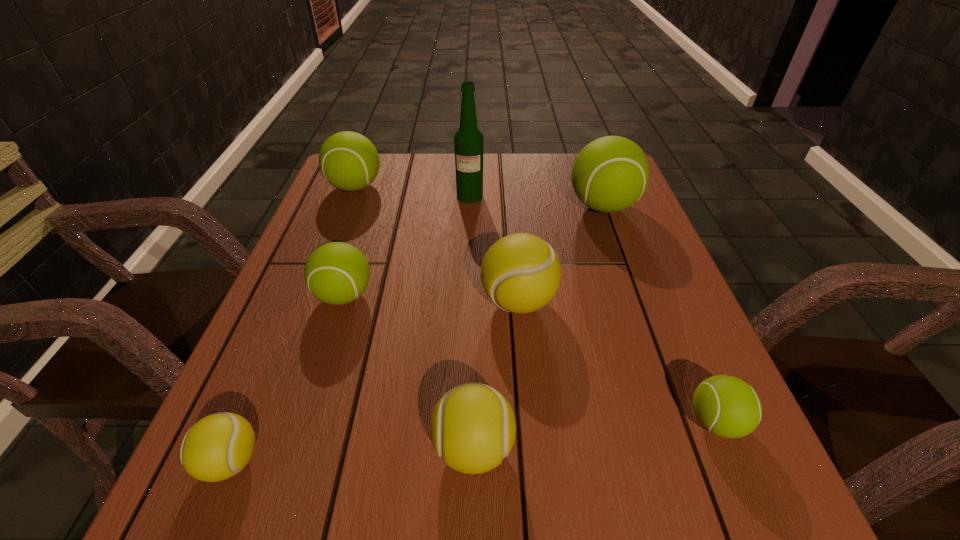
At what (x,y) coordinates should I click in order to perform the action: click on empty space that is in between the biggest green tennis ball and the nearest green tennis ball. Please return your answer as a coordinate pair (x, y). The height and width of the screenshot is (540, 960). Looking at the image, I should click on (660, 314).

The height and width of the screenshot is (540, 960). Identify the location of empty location between the second tallest object and the farthest yellow tennis ball. (561, 254).

Where is `free space between the second smallest yellow tennis ball and the green beer bottle`? free space between the second smallest yellow tennis ball and the green beer bottle is located at coordinates (471, 322).

Find the location of a particular element. This screenshot has width=960, height=540. vacant space in between the second smallest green tennis ball and the farthest yellow tennis ball is located at coordinates click(431, 299).

Find the location of `object that stands as the sixth closest to the second smallest yellow tennis ball`. object that stands as the sixth closest to the second smallest yellow tennis ball is located at coordinates (468, 140).

Locate an element on the screen. object that ranks as the second closest to the farthest yellow tennis ball is located at coordinates [x=610, y=174].

At what (x,y) coordinates should I click in order to perform the action: click on tennis ball that is the third nearest to the beer bottle. Please return your answer as a coordinate pair (x, y). Looking at the image, I should click on (521, 273).

Select which tennis ball appears as the fifth closest to the second tallest object. Please provide its 2D coordinates. Your answer should be formatted as a tuple, i.e. [(x, y)], where the tuple contains the x and y coordinates of a point satisfying the conditions above.

[(473, 428)]

Identify which green tennis ball is the second closest to the nearest green tennis ball. Please provide its 2D coordinates. Your answer should be formatted as a tuple, i.e. [(x, y)], where the tuple contains the x and y coordinates of a point satisfying the conditions above.

[(336, 273)]

Find the location of a particular element. the second closest green tennis ball relative to the smallest yellow tennis ball is located at coordinates (349, 161).